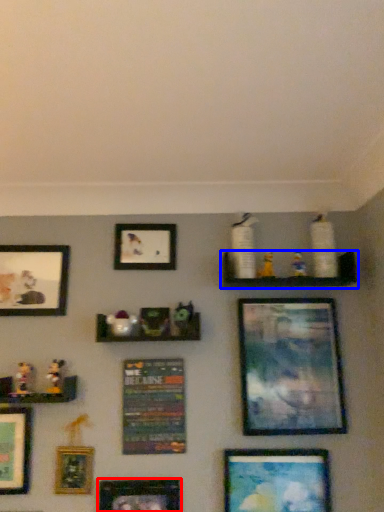
Question: Which object appears farthest to the camera in this image, picture frame (highlighted by a red box) or shelf (highlighted by a blue box)?

Choices:
 (A) picture frame
 (B) shelf

Answer: (B)